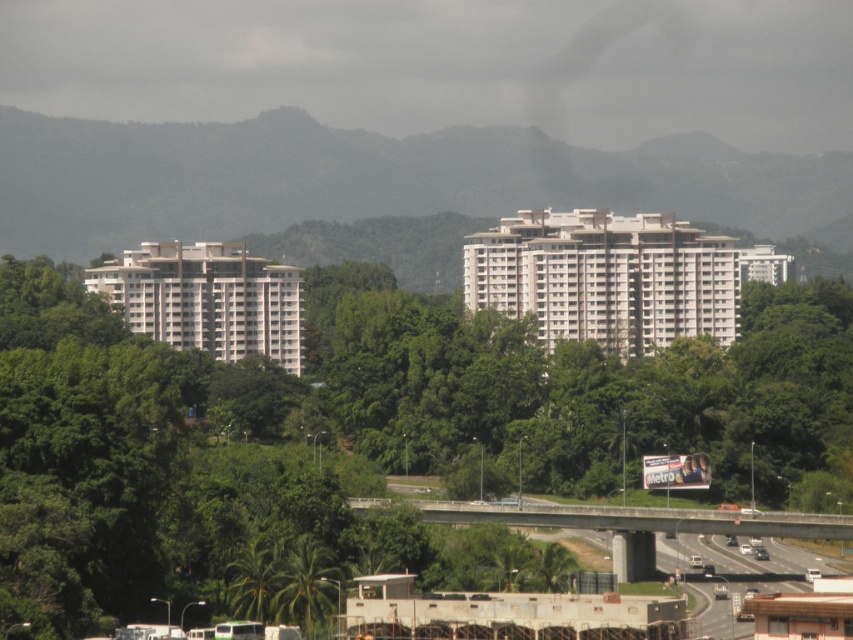
Which of these two, gray/cloudy sky at upper center or concrete highway at lower center, stands shorter?

With less height is concrete highway at lower center.

Which is more to the left, gray/cloudy sky at upper center or concrete highway at lower center?

Positioned to the left is gray/cloudy sky at upper center.

The image size is (853, 640). Identify the location of gray/cloudy sky at upper center. (447, 65).

Find the location of a particular element. gray/cloudy sky at upper center is located at coordinates (447, 65).

What do you see at coordinates (579, 390) in the screenshot?
I see `green leafy tree at center` at bounding box center [579, 390].

Does green leafy tree at center have a smaller size compared to concrete highway at lower center?

No.

Is point (741, 385) more distant than point (376, 499)?

Yes, point (741, 385) is farther from viewer.

I want to click on green leafy tree at center, so click(x=579, y=390).

Is point (590, 116) behind point (566, 442)?

Yes, it is.

Measure the distance between gray/cloudy sky at upper center and green leafy tree at center.

gray/cloudy sky at upper center and green leafy tree at center are 69.21 meters apart.

Between point (189, 17) and point (450, 496), which one is positioned behind?

The point (189, 17) is more distant.

Locate an element on the screen. The height and width of the screenshot is (640, 853). gray/cloudy sky at upper center is located at coordinates (447, 65).